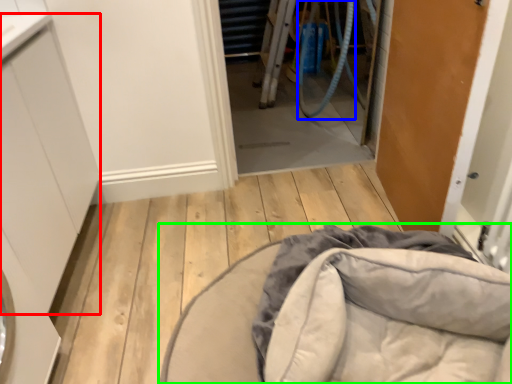
Question: Considering the real-world distances, which object is farthest from cabinetry (highlighted by a red box)? garden hose (highlighted by a blue box) or furniture (highlighted by a green box)?

Choices:
 (A) garden hose
 (B) furniture

Answer: (A)